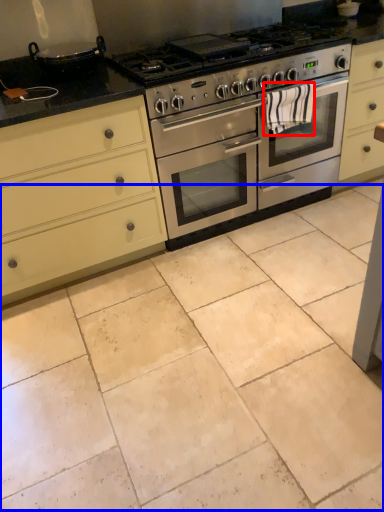
Question: Among these objects, which one is farthest to the camera, material (highlighted by a red box) or ceramic tile (highlighted by a blue box)?

Choices:
 (A) material
 (B) ceramic tile

Answer: (A)